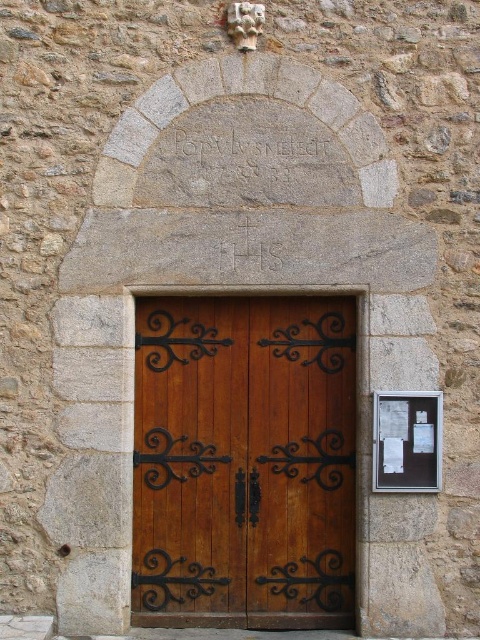
Question: Is carved stone inscription at center closer to camera compared to white paper noticeboard at right?

Choices:
 (A) no
 (B) yes

Answer: (A)

Question: Which is nearer to the wooden door at center?

Choices:
 (A) carved stone inscription at center
 (B) white paper noticeboard at right

Answer: (B)

Question: Is wooden door at center smaller than white paper noticeboard at right?

Choices:
 (A) no
 (B) yes

Answer: (A)

Question: Among these points, which one is nearest to the camera?

Choices:
 (A) (420, 464)
 (B) (228, 156)

Answer: (A)

Question: Which object appears closest to the camera in this image?

Choices:
 (A) wooden door at center
 (B) white paper noticeboard at right
 (C) carved stone inscription at center

Answer: (B)

Question: Observing the image, what is the correct spatial positioning of wooden door at center in reference to white paper noticeboard at right?

Choices:
 (A) above
 (B) below

Answer: (B)